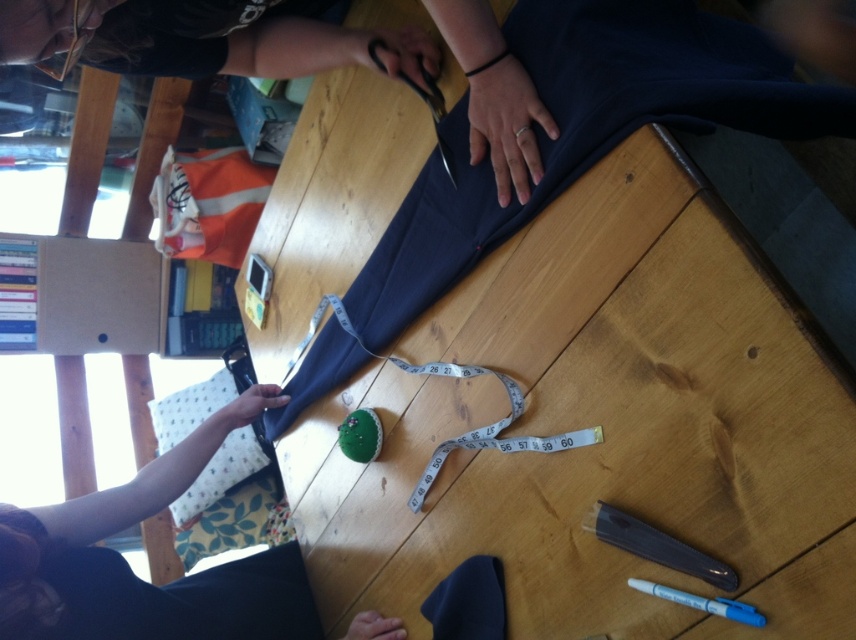
In the scene shown: You are a tailor working on the table and need to reach for a pen. You have a 1.5 inch long hand span. Can you comfortably grasp either the translucent plastic pen at lower right or the blue plastic pen at lower right without moving your hand position?

The distance between the translucent plastic pen at lower right and blue plastic pen at lower right is 1.41 inches. Since your hand span is 1.5 inches, you can comfortably grasp either pen without moving your hand position as the distance is within your reach.

Based on the photo, you are a tailor working on a project and need to place a new item on the table. The table has the matte black fabric at upper center and the translucent plastic pen at lower right. Which object takes up more vertical space on the table?

The matte black fabric at upper center is much taller than the translucent plastic pen at lower right, so it takes up more vertical space on the table.